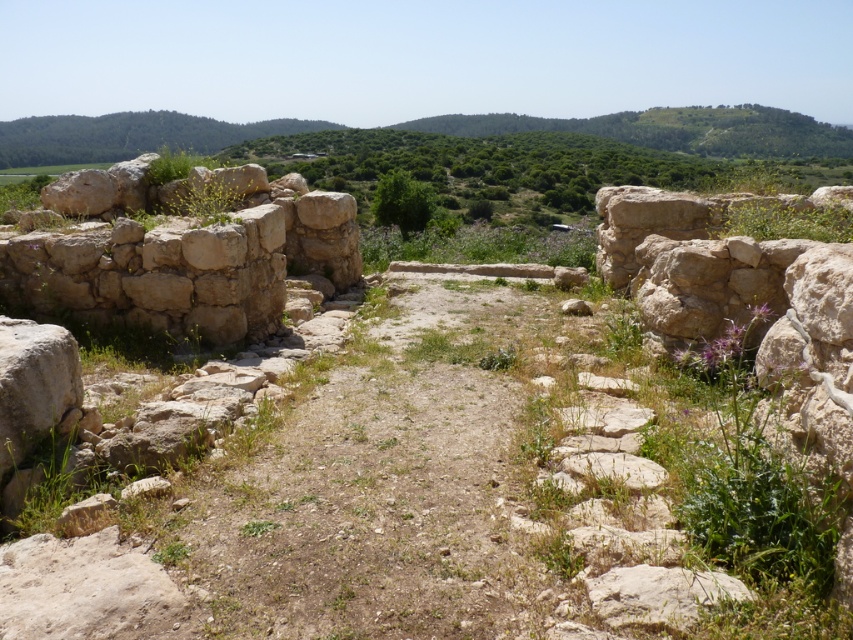
Can you confirm if dirt path at center is positioned below beige rough stone wall at left?

Yes.

Is point (320, 488) farther from viewer compared to point (305, 228)?

No, it is in front of (305, 228).

At what (x,y) coordinates should I click in order to perform the action: click on dirt path at center. Please return your answer as a coordinate pair (x, y). Looking at the image, I should click on (381, 484).